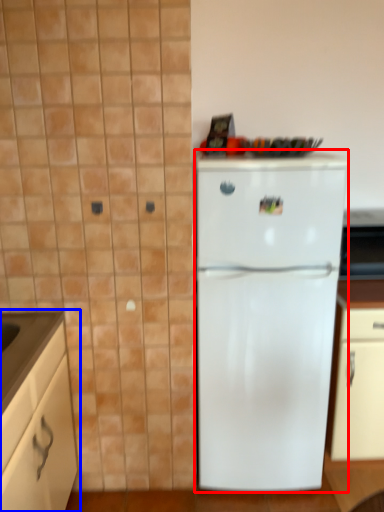
Question: Among these objects, which one is farthest to the camera, refrigerator (highlighted by a red box) or cabinetry (highlighted by a blue box)?

Choices:
 (A) refrigerator
 (B) cabinetry

Answer: (A)